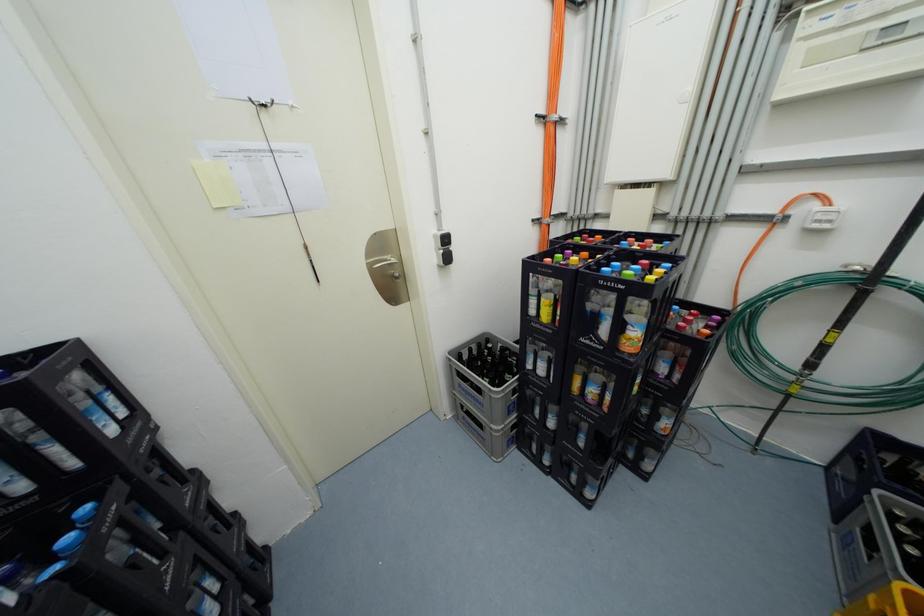
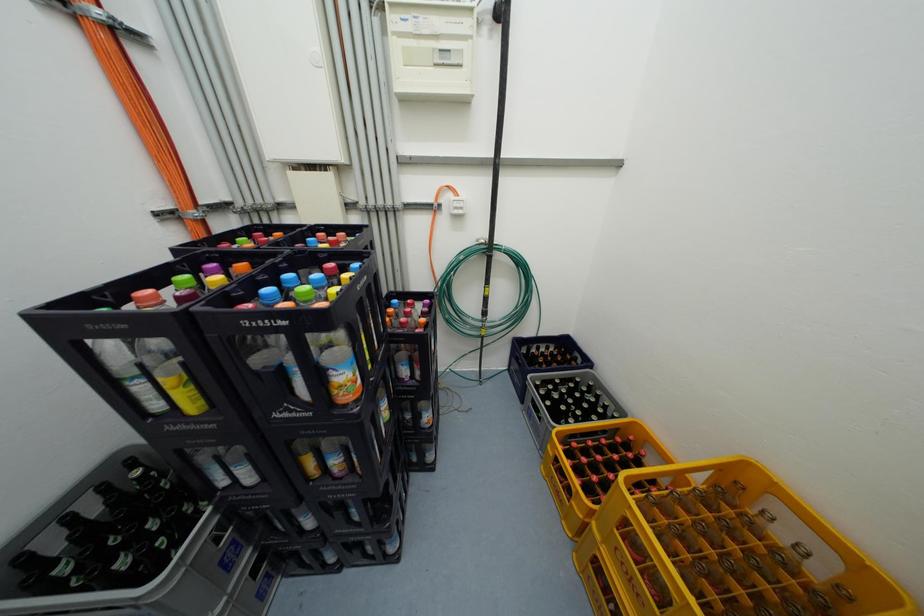
Question: The camera is either moving clockwise (left) or counter-clockwise (right) around the object. The first image is from the beginning of the video and the second image is from the end. Is the camera moving left or right when shooting the video?

Choices:
 (A) Left
 (B) Right

Answer: (A)